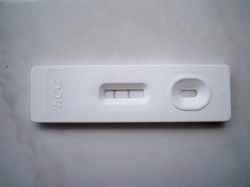
The image size is (250, 187). I want to click on table top, so click(154, 161), click(19, 143), click(34, 45).